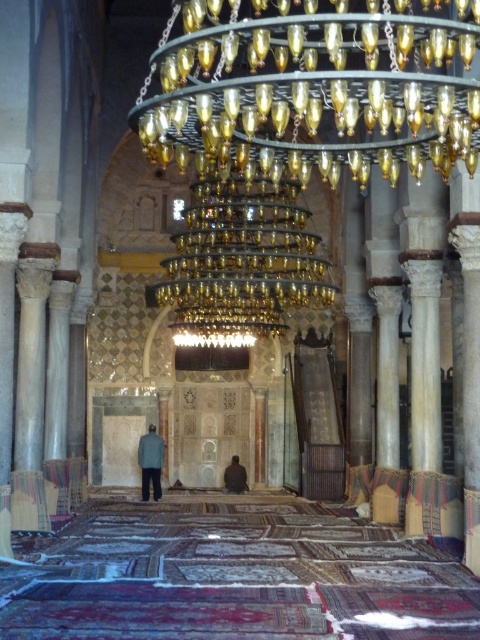
Question: Which point is closer to the camera?

Choices:
 (A) gold metallic chandelier at upper center
 (B) gray fabric person at center

Answer: (A)

Question: Among these points, which one is nearest to the camera?

Choices:
 (A) (226, 472)
 (B) (349, 134)

Answer: (B)

Question: From the image, what is the correct spatial relationship of gray fabric person at center in relation to brown leather jacket at center?

Choices:
 (A) below
 (B) above

Answer: (B)

Question: Can you confirm if gold metallic chandelier at upper center is bigger than brown leather jacket at center?

Choices:
 (A) no
 (B) yes

Answer: (B)

Question: Estimate the real-world distances between objects in this image. Which object is closer to the gold metallic chandelier at upper center?

Choices:
 (A) brown leather jacket at center
 (B) gray fabric person at center

Answer: (B)

Question: Does gold metallic chandelier at upper center have a smaller size compared to brown leather jacket at center?

Choices:
 (A) yes
 (B) no

Answer: (B)